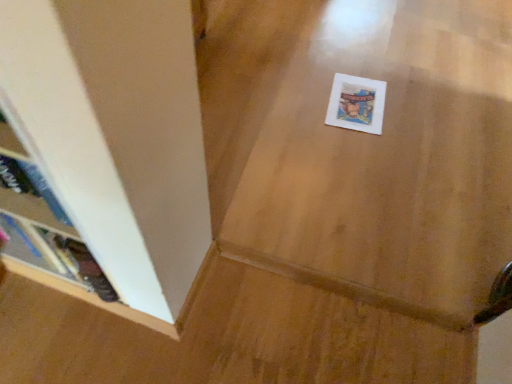
Question: From the image's perspective, is white paper postcard at center above or below wooden bookshelf at left?

Choices:
 (A) above
 (B) below

Answer: (A)

Question: In terms of width, does white paper postcard at center look wider or thinner when compared to wooden bookshelf at left?

Choices:
 (A) thin
 (B) wide

Answer: (B)

Question: Do you think white paper postcard at center is within wooden bookshelf at left, or outside of it?

Choices:
 (A) outside
 (B) inside

Answer: (A)

Question: From the image's perspective, is wooden bookshelf at left positioned above or below white paper postcard at center?

Choices:
 (A) above
 (B) below

Answer: (B)

Question: Does point (66, 274) appear closer or farther from the camera than point (371, 99)?

Choices:
 (A) closer
 (B) farther

Answer: (A)

Question: Is wooden bookshelf at left situated inside white paper postcard at center or outside?

Choices:
 (A) outside
 (B) inside

Answer: (A)

Question: Visually, is wooden bookshelf at left positioned to the left or to the right of white paper postcard at center?

Choices:
 (A) left
 (B) right

Answer: (A)